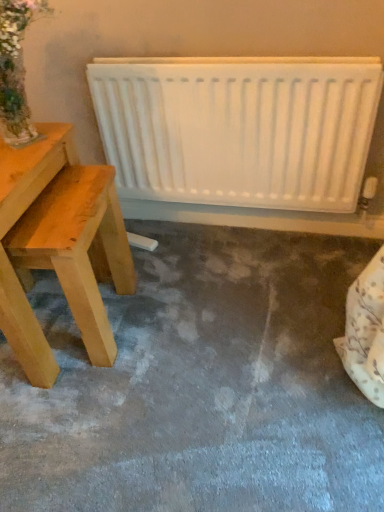
You are a GUI agent. You are given a task and a screenshot of the screen. Output one action in this format:
    pyautogui.click(x=<x>, y=<y>)
    Task: Click on the white matte radiator at upper center
    This screenshot has height=512, width=384.
    Given the screenshot: What is the action you would take?
    pyautogui.click(x=238, y=129)

From the picture: What is the approximate height of white matte radiator at upper center?

It is 23.31 inches.

What do you see at coordinates (238, 129) in the screenshot? The width and height of the screenshot is (384, 512). I see `white matte radiator at upper center` at bounding box center [238, 129].

This screenshot has height=512, width=384. What do you see at coordinates (59, 245) in the screenshot?
I see `light wood table at left` at bounding box center [59, 245].

Find the location of a particular element. This screenshot has width=384, height=512. light wood table at left is located at coordinates (59, 245).

Measure the distance between light wood table at left and camera.

light wood table at left and camera are 3.30 feet apart.

The width and height of the screenshot is (384, 512). In order to click on white matte radiator at upper center in this screenshot , I will do `click(238, 129)`.

Would you say white matte radiator at upper center is to the left or to the right of light wood table at left in the picture?

Clearly, white matte radiator at upper center is on the right of light wood table at left in the image.

Does white matte radiator at upper center lie behind light wood table at left?

Yes, white matte radiator at upper center is behind light wood table at left.

Between point (284, 200) and point (126, 288), which one is positioned behind?

The point (284, 200) is farther from the camera.

From the image's perspective, which object appears higher, white matte radiator at upper center or light wood table at left?

From the image's view, white matte radiator at upper center is above.

From a real-world perspective, relative to light wood table at left, is white matte radiator at upper center vertically above or below?

In terms of real-world spatial position, white matte radiator at upper center is above light wood table at left.

Which of these two, white matte radiator at upper center or light wood table at left, is thinner?

white matte radiator at upper center.

Which of these two, white matte radiator at upper center or light wood table at left, stands shorter?

Standing shorter between the two is white matte radiator at upper center.

Considering the relative sizes of white matte radiator at upper center and light wood table at left in the image provided, is white matte radiator at upper center smaller than light wood table at left?

Indeed, white matte radiator at upper center has a smaller size compared to light wood table at left.

In the scene shown: Is white matte radiator at upper center located outside light wood table at left?

white matte radiator at upper center is positioned outside light wood table at left.

Looking at this image, would you consider white matte radiator at upper center to be distant from light wood table at left?

white matte radiator at upper center is actually quite close to light wood table at left.

Is white matte radiator at upper center looking in the opposite direction of light wood table at left?

No.

How many degrees apart are the facing directions of white matte radiator at upper center and light wood table at left?

The angle between the facing direction of white matte radiator at upper center and the facing direction of light wood table at left is 3.26 degrees.

Identify the location of table in front of the white matte radiator at upper center. The image size is (384, 512). 59,245.

Which is more to the right, light wood table at left or white matte radiator at upper center?

Positioned to the right is white matte radiator at upper center.

Which object is further away from the camera taking this photo, light wood table at left or white matte radiator at upper center?

white matte radiator at upper center is more distant.

Considering the points (45, 129) and (351, 152), which point is in front, point (45, 129) or point (351, 152)?

The point (45, 129) is closer.

In the scene shown: From the image's perspective, is light wood table at left located above or below white matte radiator at upper center?

Clearly, from the image's perspective, light wood table at left is below white matte radiator at upper center.

From a real-world perspective, is light wood table at left above or below white matte radiator at upper center?

From a real-world perspective, light wood table at left is physically below white matte radiator at upper center.

Between light wood table at left and white matte radiator at upper center, which one has larger width?

Wider between the two is light wood table at left.

Which of these two, light wood table at left or white matte radiator at upper center, stands taller?

Standing taller between the two is light wood table at left.

Which of these two, light wood table at left or white matte radiator at upper center, is smaller?

With smaller size is white matte radiator at upper center.

Is light wood table at left inside the boundaries of white matte radiator at upper center, or outside?

light wood table at left is not enclosed by white matte radiator at upper center.

Is there a large distance between light wood table at left and white matte radiator at upper center?

light wood table at left is near white matte radiator at upper center, not far away.

Is light wood table at left oriented towards white matte radiator at upper center?

No, light wood table at left is not facing towards white matte radiator at upper center.

Locate an element on the screen. table lying in front of the white matte radiator at upper center is located at coordinates (59, 245).

Locate an element on the screen. table on the left of white matte radiator at upper center is located at coordinates (59, 245).

This screenshot has width=384, height=512. Identify the location of radiator located above the light wood table at left (from the image's perspective). (238, 129).